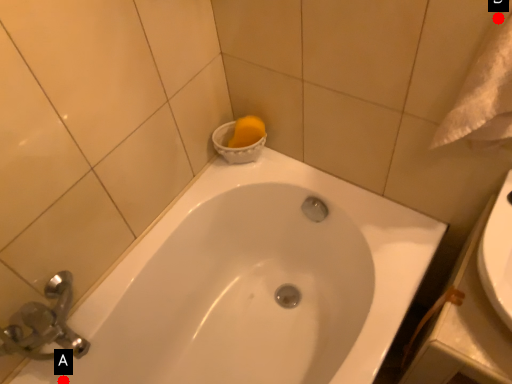
Question: Two points are circled on the image, labeled by A and B beside each circle. Which point is closer to the camera?

Choices:
 (A) A is closer
 (B) B is closer

Answer: (B)